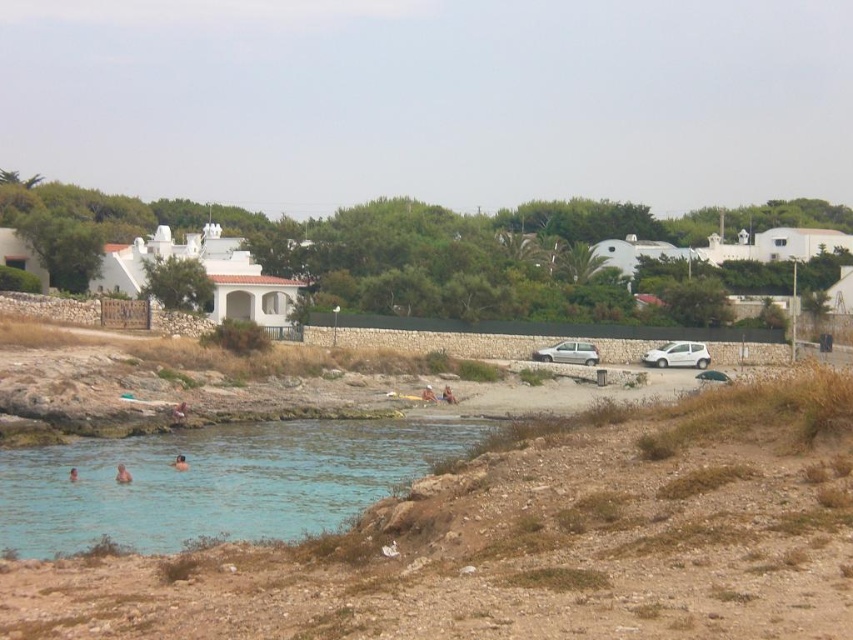
You are standing at the shoreline and want to reach both points in the image. Which point, point (119, 474) or point (428, 401), will you reach first as you move forward?

Point (119, 474) is closer to the viewer than point (428, 401), so you will reach point (119, 474) first.

You are a delivery driver who needs to park your vehicle in this coastal area. You have a white matte van at right and a satin silver van at center. Which van should you choose to park closer to the sandy area where people are relaxing?

The white matte van at right is smaller in size compared to the satin silver van at center, so choosing the white matte van at right would allow you to park closer to the sandy area where people are relaxing without taking up too much space.

You are a delivery person who needs to park your van. You see a white matte van at right and a satin silver van at center. If your van is 5 meters long, can you park between them without moving either van?

The distance between the white matte van at right and the satin silver van at center is 4.44 meters. Since your van is 5 meters long, it is longer than the available space, so you cannot park between them without moving either van.